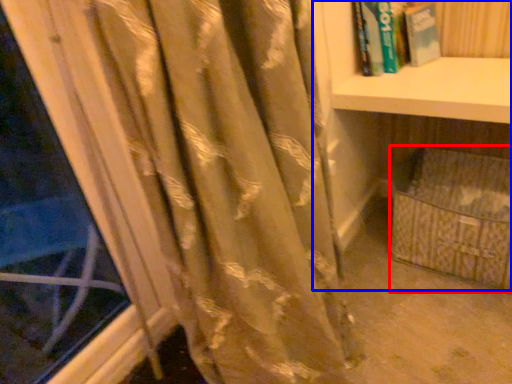
Question: Which object appears farthest to the camera in this image, basket (highlighted by a red box) or bookcase (highlighted by a blue box)?

Choices:
 (A) basket
 (B) bookcase

Answer: (A)